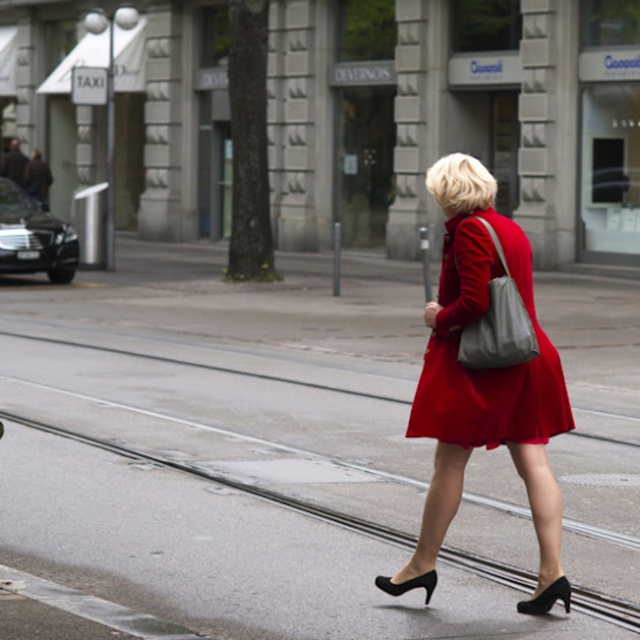
Does black leather heel at lower center have a greater height compared to black leather high-heeled shoe at lower center?

Indeed, black leather heel at lower center has a greater height compared to black leather high-heeled shoe at lower center.

Does black leather heel at lower center appear on the right side of black leather high-heeled shoe at lower center?

Yes, black leather heel at lower center is to the right of black leather high-heeled shoe at lower center.

Is point (545, 596) closer to viewer compared to point (432, 573)?

Yes, point (545, 596) is closer to viewer.

Identify the location of black leather heel at lower center. (547, 598).

Is matte red coat at center wider than satin red dress at center?

Indeed, matte red coat at center has a greater width compared to satin red dress at center.

Locate an element on the screen. matte red coat at center is located at coordinates (483, 371).

Is point (516, 225) farther from camera compared to point (548, 346)?

That is True.

At what (x,y) coordinates should I click in order to perform the action: click on matte red coat at center. Please return your answer as a coordinate pair (x, y). The height and width of the screenshot is (640, 640). Looking at the image, I should click on (483, 371).

Can you confirm if satin red dress at center is positioned to the left of black leather high-heeled shoe at lower center?

No, satin red dress at center is not to the left of black leather high-heeled shoe at lower center.

Does point (458, 372) lie in front of point (417, 588)?

Yes, it is in front of point (417, 588).

Is point (556, 387) positioned in front of point (422, 584)?

No, it is behind (422, 584).

Where is `satin red dress at center`? satin red dress at center is located at coordinates (490, 369).